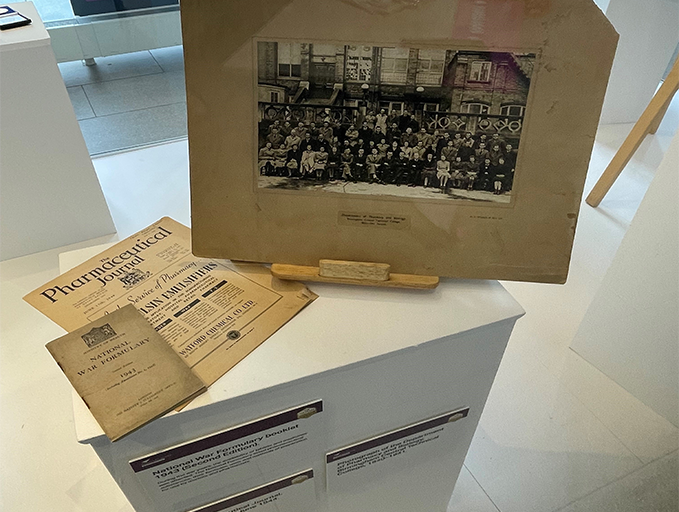
Where is `floor`? The image size is (679, 512). floor is located at coordinates (532, 443).